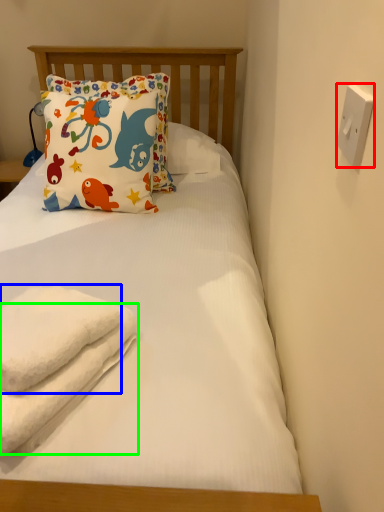
Question: Estimate the real-world distances between objects in this image. Which object is farther from electric outlet (highlighted by a red box), towel (highlighted by a blue box) or beach towel (highlighted by a green box)?

Choices:
 (A) towel
 (B) beach towel

Answer: (B)